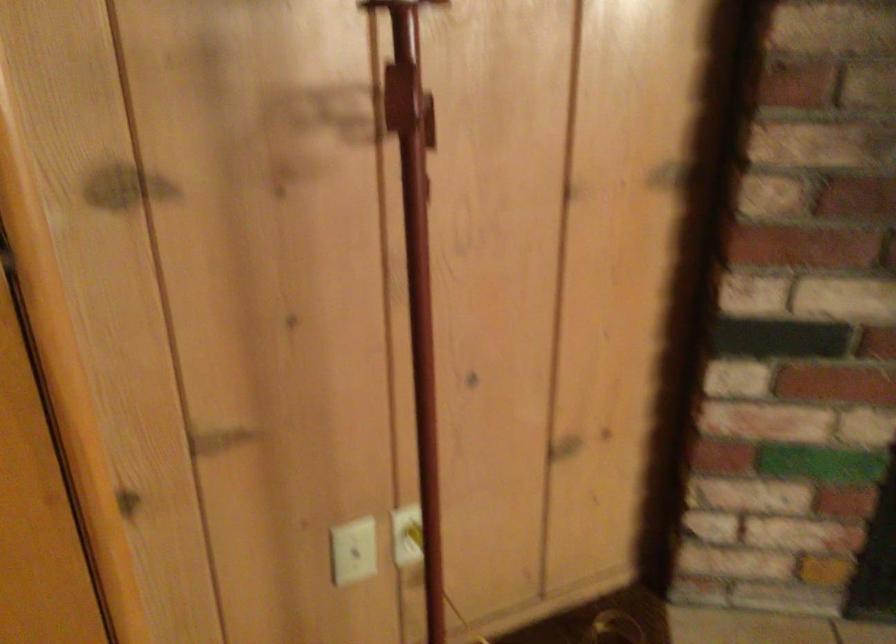
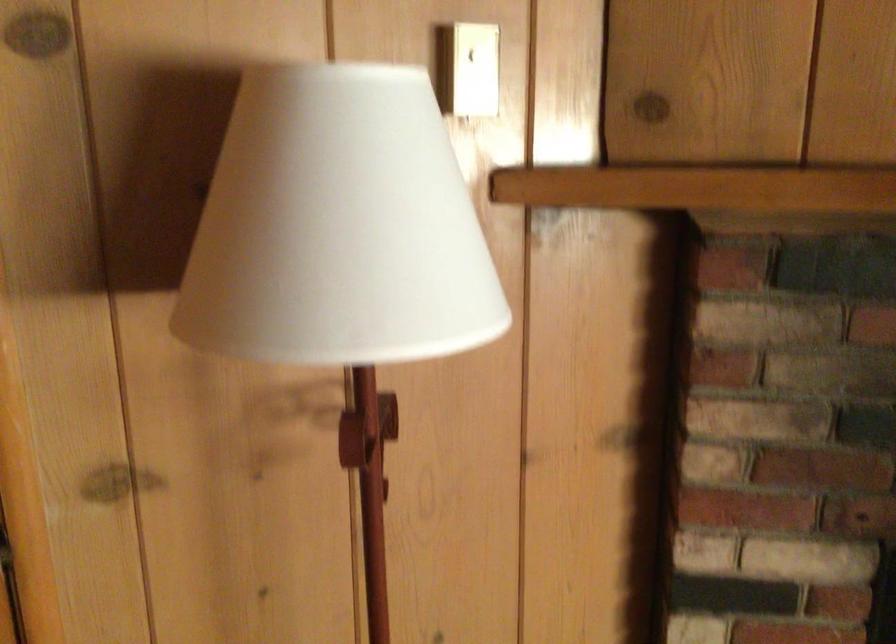
Question: The images are taken continuously from a first-person perspective. In which direction is your viewpoint rotating?

Choices:
 (A) Left
 (B) Right
 (C) Up
 (D) Down

Answer: (C)